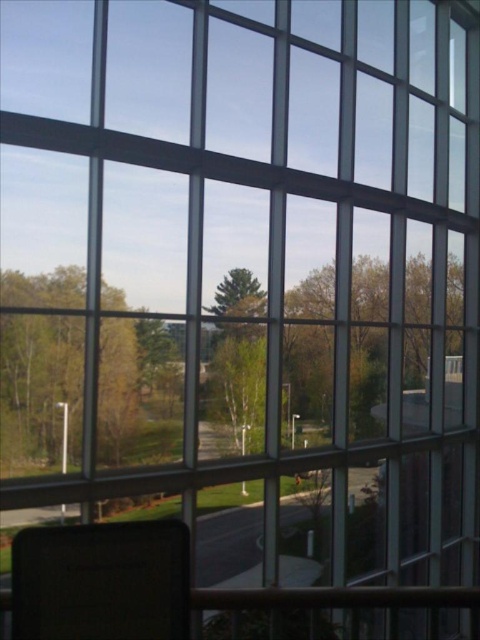
Question: Which point is farther from the camera taking this photo?

Choices:
 (A) coord(227,284)
 (B) coord(136,561)

Answer: (A)

Question: Can you confirm if matte black chair at lower left is bigger than green matte tree at center?

Choices:
 (A) yes
 (B) no

Answer: (B)

Question: Which object is closer to the camera taking this photo?

Choices:
 (A) matte black chair at lower left
 (B) green matte tree at center

Answer: (A)

Question: Is matte black chair at lower left positioned before green matte tree at center?

Choices:
 (A) no
 (B) yes

Answer: (B)

Question: Which point is farther to the camera?

Choices:
 (A) matte black chair at lower left
 (B) green matte tree at center

Answer: (B)

Question: Considering the relative positions of matte black chair at lower left and green matte tree at center in the image provided, where is matte black chair at lower left located with respect to green matte tree at center?

Choices:
 (A) left
 (B) right

Answer: (B)